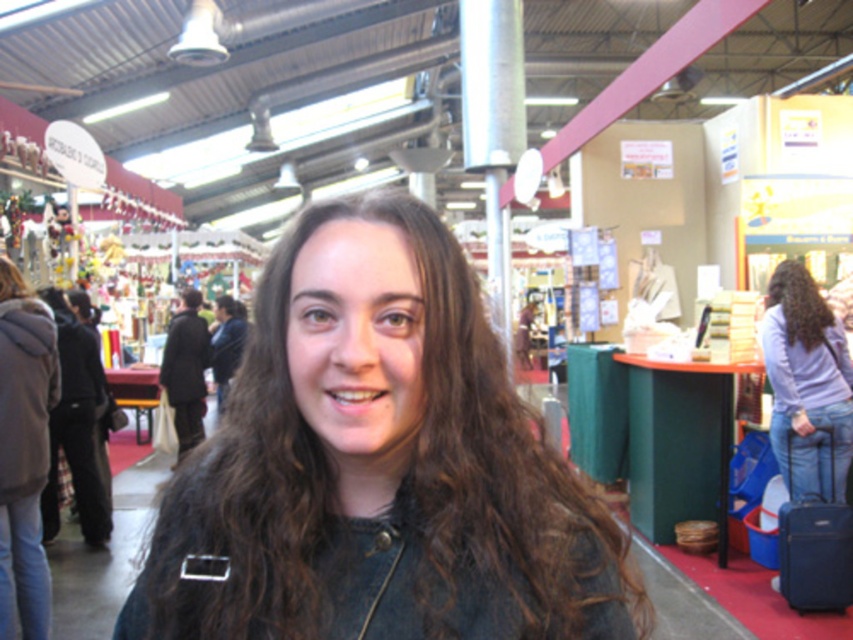
Is point (54, 330) positioned in front of point (834, 388)?

Yes.

Which is above, fuzzy gray coat at left or light purple fabric at center?

light purple fabric at center is higher up.

At what (x,y) coordinates should I click in order to perform the action: click on fuzzy gray coat at left. Please return your answer as a coordinate pair (x, y). The height and width of the screenshot is (640, 853). Looking at the image, I should click on (22, 452).

Can you confirm if fuzzy gray coat at left is smaller than curly brown hair at right?

Incorrect, fuzzy gray coat at left is not smaller in size than curly brown hair at right.

Which is behind, point (0, 605) or point (820, 316)?

Positioned behind is point (820, 316).

Image resolution: width=853 pixels, height=640 pixels. What are the coordinates of `fuzzy gray coat at left` in the screenshot? It's located at (22, 452).

Is dark brown hair at center to the left of curly brown hair at right from the viewer's perspective?

Yes, dark brown hair at center is to the left of curly brown hair at right.

Is dark brown hair at center positioned in front of curly brown hair at right?

Yes, dark brown hair at center is closer to the viewer.

Locate an element on the screen. The image size is (853, 640). dark brown hair at center is located at coordinates (376, 465).

Where is `dark brown hair at center`? dark brown hair at center is located at coordinates (376, 465).